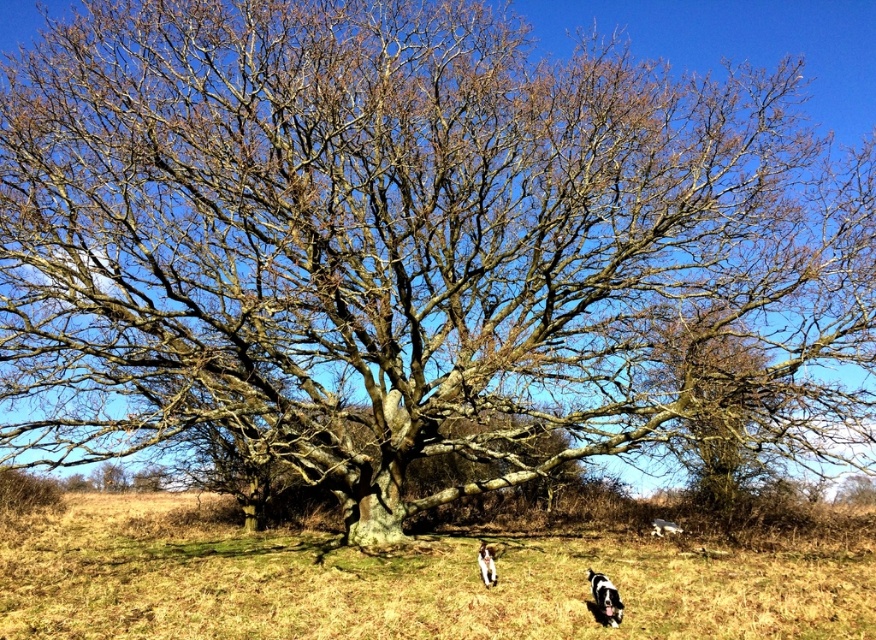
Question: Can you confirm if brown grass at center is positioned above white fur dog at lower center?

Choices:
 (A) yes
 (B) no

Answer: (B)

Question: Is brown grass at center to the left of white fur dog at lower center from the viewer's perspective?

Choices:
 (A) no
 (B) yes

Answer: (B)

Question: Does brown grass at center appear under white fur dog at lower center?

Choices:
 (A) no
 (B) yes

Answer: (B)

Question: Which of the following is the farthest from the observer?

Choices:
 (A) (331, 595)
 (B) (484, 556)

Answer: (B)